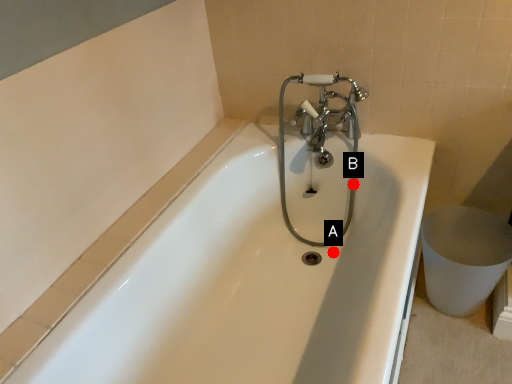
Question: Two points are circled on the image, labeled by A and B beside each circle. Which point appears closest to the camera in this image?

Choices:
 (A) A is closer
 (B) B is closer

Answer: (B)